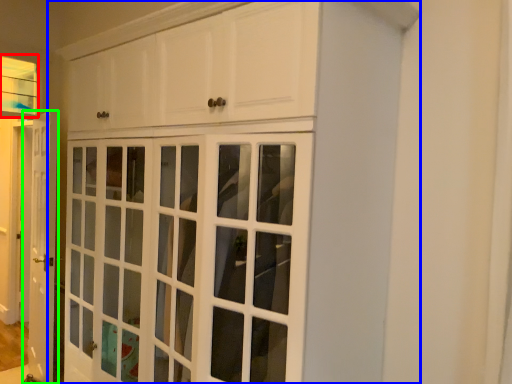
Question: Which object is positioned farthest from window (highlighted by a red box)? Select from cupboard (highlighted by a blue box) and door (highlighted by a green box).

Choices:
 (A) cupboard
 (B) door

Answer: (A)